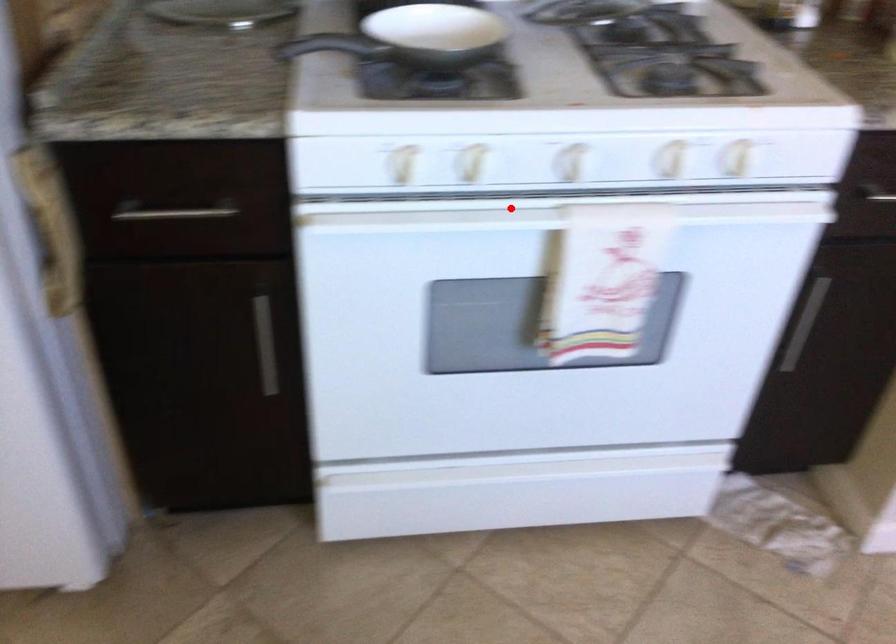
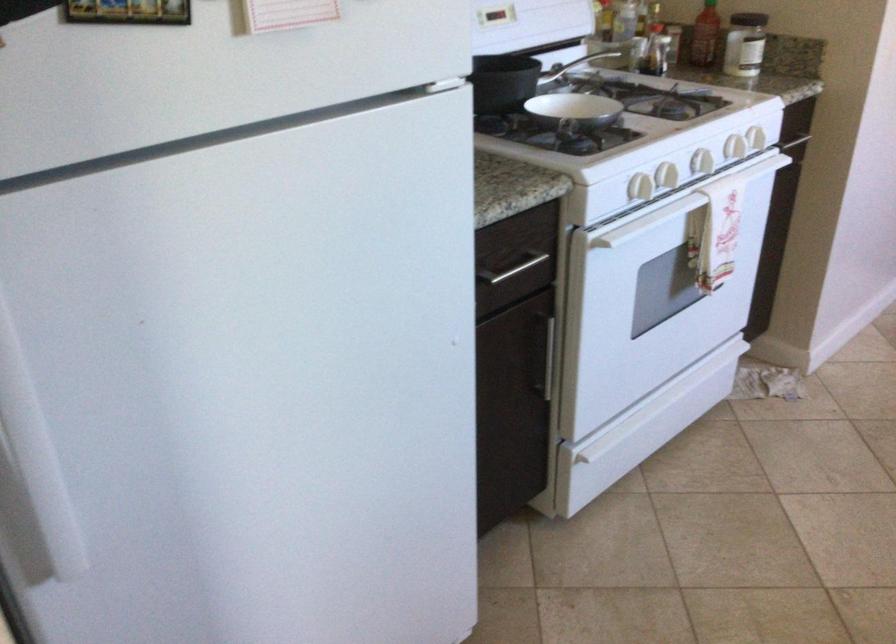
The point at the highlighted location is marked in the first image. Where is the corresponding point in the second image?

(702, 162)